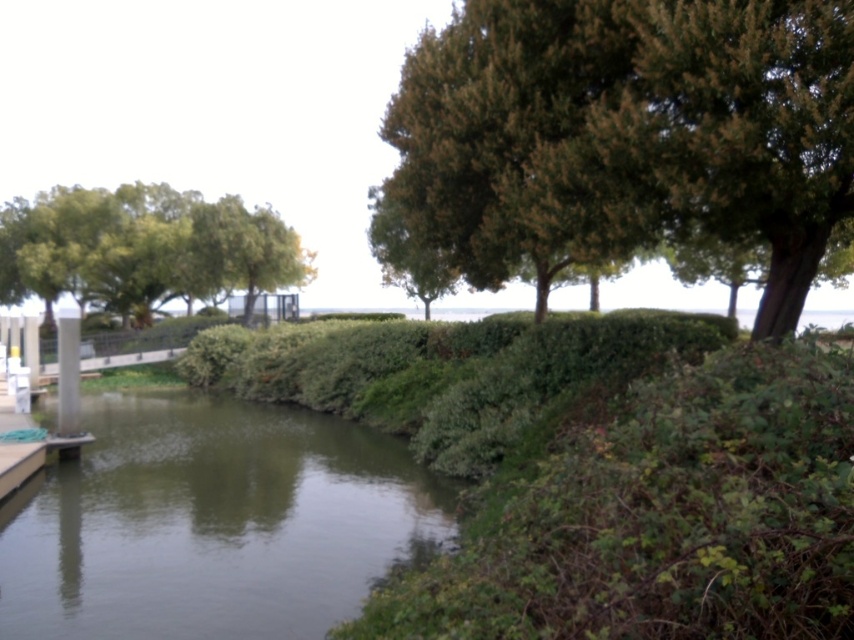
You are standing in the middle of the green grassy river at lower left and want to reach the green leafy tree at upper right. Which direction should you walk to get closer to the tree?

The green leafy tree at upper right is taller than the green grassy river at lower left, but to determine the direction to walk, you need to consider their positions. Since the tree is at the upper right and the river is at the lower left, you should walk towards the upper right direction to get closer to the tree.

You are planning to install a new bench in this outdoor area. The bench requires a minimum of 90 feet of space between two trees to ensure stability. Based on the scene, will the distance between the green leafy tree at upper right and the green leafy tree at left be sufficient for placing the bench?

The green leafy tree at upper right and the green leafy tree at left are 89.75 feet apart from each other. Since the required minimum distance is 90 feet, the available space is insufficient for placing the bench.